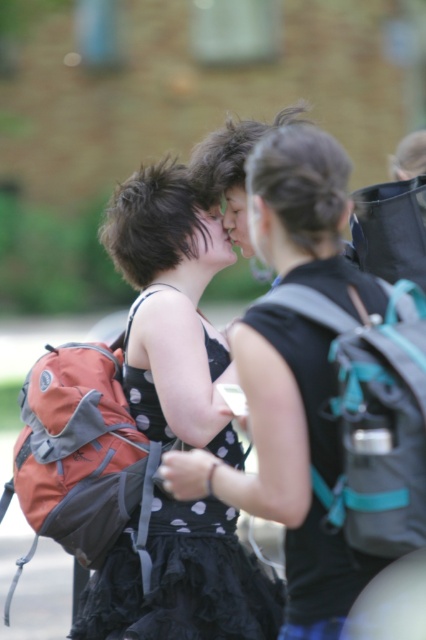
You are planning to carry both the matte black backpack at center and the teal fabric backpack at center during a hike. Which backpack will require more space in your luggage compartment?

The matte black backpack at center requires more space in the luggage compartment because it is larger than the teal fabric backpack at center.